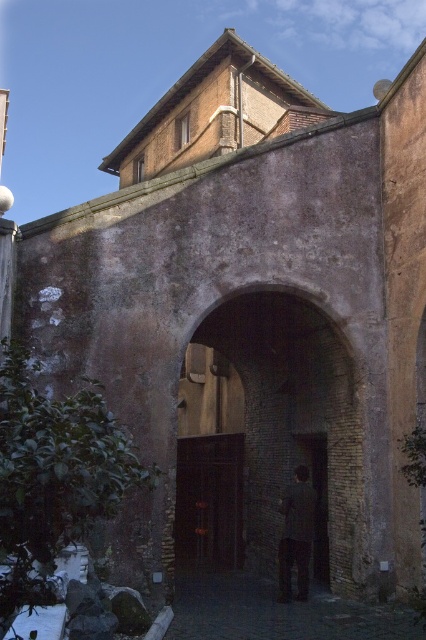
From the picture: You are a delivery person carrying a large box that is 2 meters wide. You need to pass through either the dark brick archway at center or the dark stone alley at center. Based on their widths, which path should you choose to ensure your box can fit through?

The dark brick archway at center is thinner than the dark stone alley at center, so you should choose the dark stone alley at center since it is wider and can accommodate the 2 meter wide box.

You are a painter standing in front of the dark brick archway at center and the dark gray suit at center. You want to paint both subjects on a canvas. Which object should you focus on first if you want to capture the tallest subject?

The dark brick archway at center has a greater height compared to the dark gray suit at center, so you should focus on painting the dark brick archway at center first to capture the tallest subject.